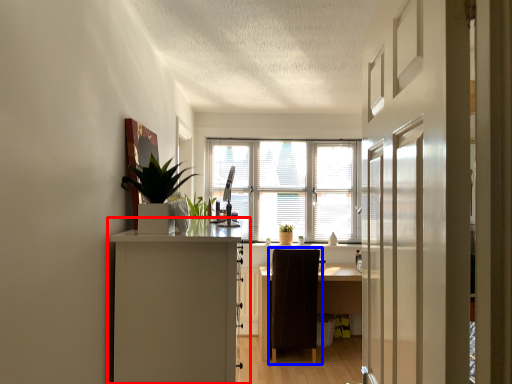
Question: Which point is closer to the camera, cabinetry (highlighted by a red box) or chair (highlighted by a blue box)?

Choices:
 (A) cabinetry
 (B) chair

Answer: (A)